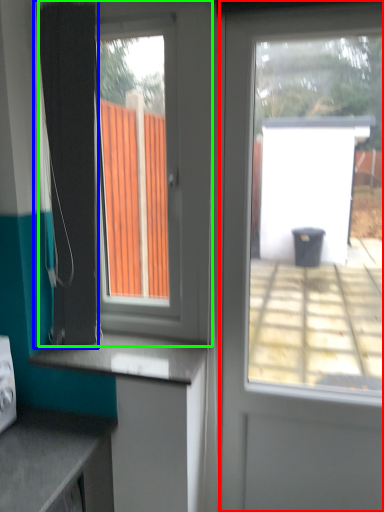
Question: Estimate the real-world distances between objects in this image. Which object is farther from door (highlighted by a red box), shower curtain (highlighted by a blue box) or window (highlighted by a green box)?

Choices:
 (A) shower curtain
 (B) window

Answer: (A)